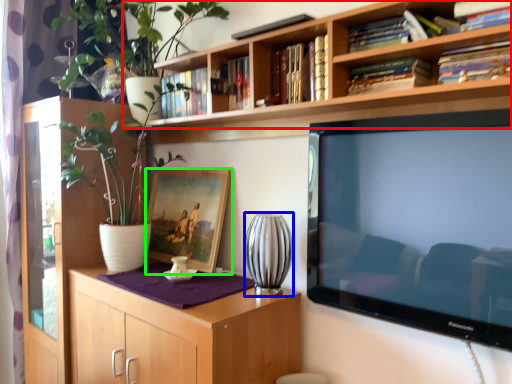
Question: Which object is positioned farthest from bookcase (highlighted by a red box)? Select from vase (highlighted by a blue box) and picture frame (highlighted by a green box).

Choices:
 (A) vase
 (B) picture frame

Answer: (B)